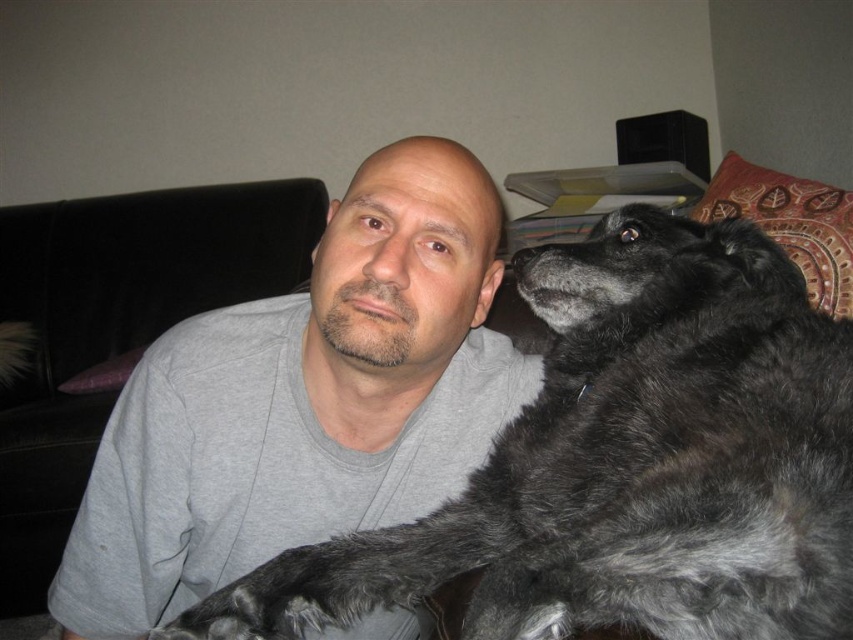
Can you confirm if gray cotton shirt at center is shorter than black leather couch at left?

Yes.

Does point (489, 420) come farther from viewer compared to point (177, 244)?

No.

I want to click on gray cotton shirt at center, so click(305, 401).

Is point (845, 474) positioned before point (230, 467)?

Yes, it is.

Does fuzzy black dog at center appear over gray cotton shirt at center?

Yes, fuzzy black dog at center is above gray cotton shirt at center.

Who is more forward, (730, 481) or (397, 460)?

Positioned in front is point (730, 481).

The image size is (853, 640). Find the location of `fuzzy black dog at center`. fuzzy black dog at center is located at coordinates (625, 464).

Looking at this image, is fuzzy black dog at center to the left of black leather couch at left from the viewer's perspective?

In fact, fuzzy black dog at center is to the right of black leather couch at left.

Where is `fuzzy black dog at center`? This screenshot has width=853, height=640. fuzzy black dog at center is located at coordinates (625, 464).

Is point (699, 611) positioned after point (30, 600)?

That is False.

Identify the location of fuzzy black dog at center. This screenshot has height=640, width=853. (625, 464).